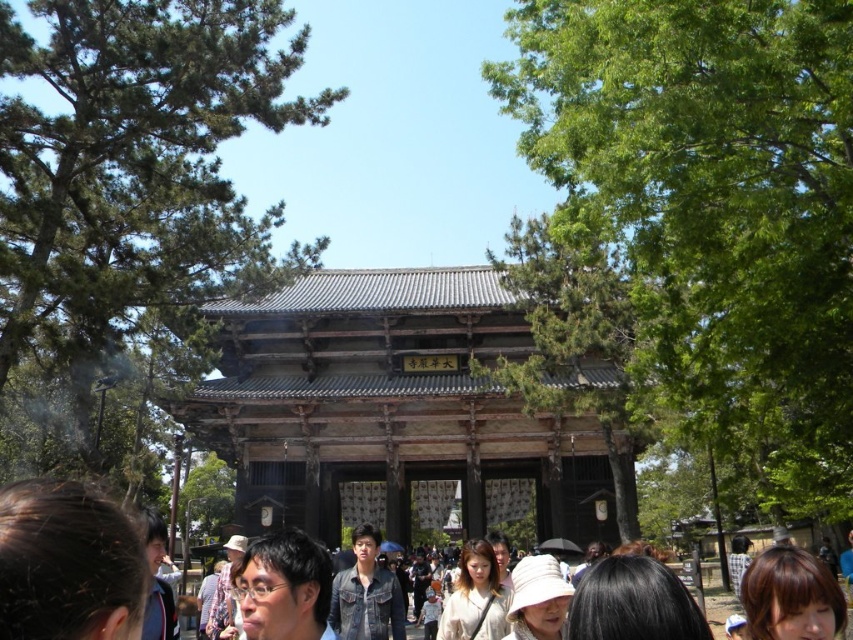
Question: Among these points, which one is nearest to the camera?

Choices:
 (A) (521, 620)
 (B) (238, 612)

Answer: (A)

Question: Does brown wooden temple at center appear on the right side of denim jacket at center?

Choices:
 (A) no
 (B) yes

Answer: (B)

Question: Which of these objects is positioned farthest from the black hair at lower center?

Choices:
 (A) dark brown leather jacket at lower left
 (B) brown hair at lower left
 (C) brown hair at lower right
 (D) brown wooden temple at center

Answer: (D)

Question: Is brown wooden temple at center above white fabric hat at center?

Choices:
 (A) yes
 (B) no

Answer: (A)

Question: Does matte black glasses at lower center lie behind white fabric hat at center?

Choices:
 (A) yes
 (B) no

Answer: (B)

Question: Based on their relative distances, which object is farther from the brown hair at lower left?

Choices:
 (A) black hair at lower center
 (B) denim jacket at center
 (C) white fabric hat at center
 (D) light beige cotton shirt at center

Answer: (D)